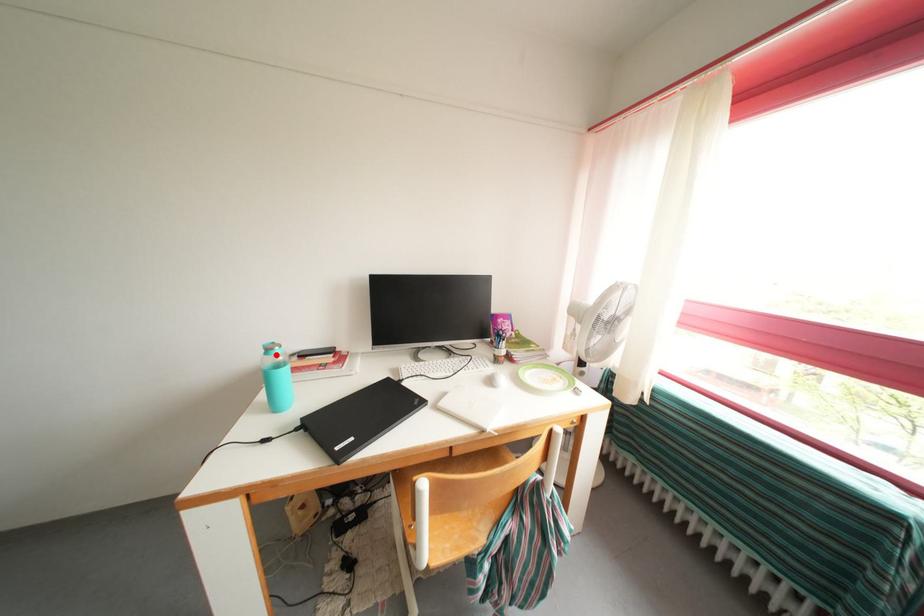
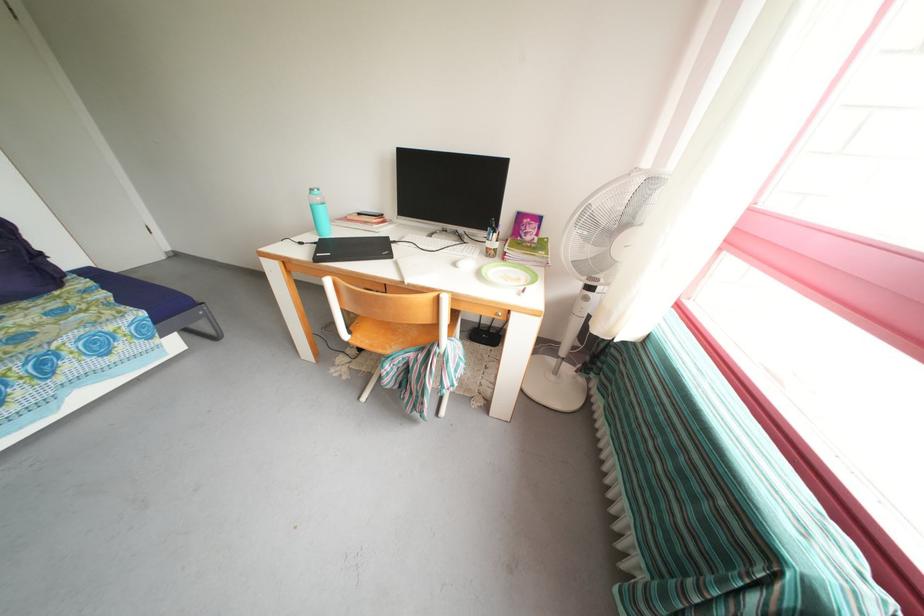
Find the pixel in the second image that matches the highlighted location in the first image.

(319, 196)